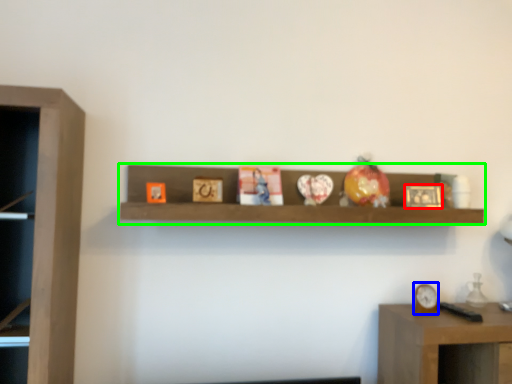
Question: Which object is positioned closest to picture frame (highlighted by a red box)? Select from clock (highlighted by a blue box) and shelf (highlighted by a green box).

Choices:
 (A) clock
 (B) shelf

Answer: (A)